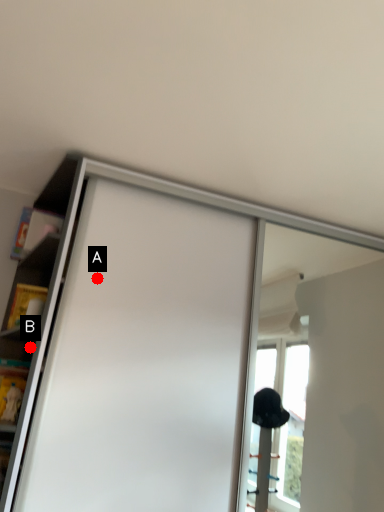
Question: Two points are circled on the image, labeled by A and B beside each circle. Which point appears farthest from the camera in this image?

Choices:
 (A) A is further
 (B) B is further

Answer: (B)